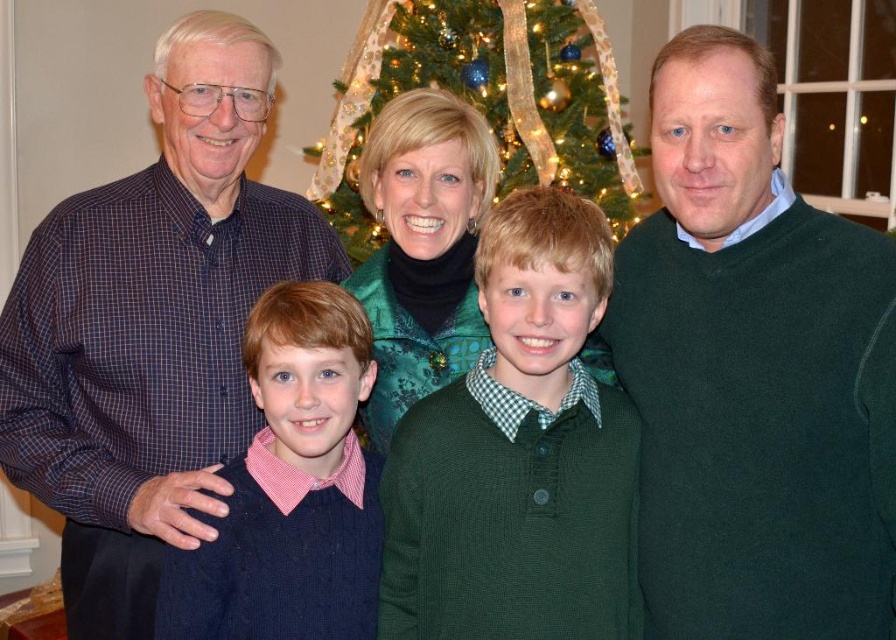
Question: Which point is closer to the camera?

Choices:
 (A) (347, 337)
 (B) (562, 49)
 (C) (602, 634)

Answer: (C)

Question: Among these points, which one is nearest to the camera?

Choices:
 (A) (573, 13)
 (B) (791, 493)
 (C) (393, 522)
 (D) (102, 433)

Answer: (B)

Question: Which point is closer to the camera taking this photo?

Choices:
 (A) click(x=351, y=454)
 (B) click(x=817, y=474)
 (C) click(x=553, y=492)
 (D) click(x=415, y=12)

Answer: (B)

Question: Does plaid shirt at left have a greater width compared to green knitted sweater at center?

Choices:
 (A) no
 (B) yes

Answer: (B)

Question: Does plaid shirt at left appear under knitted dark blue sweater at center?

Choices:
 (A) no
 (B) yes

Answer: (A)

Question: Can you confirm if green knitted sweater at center is positioned to the left of knitted dark blue sweater at center?

Choices:
 (A) yes
 (B) no

Answer: (B)